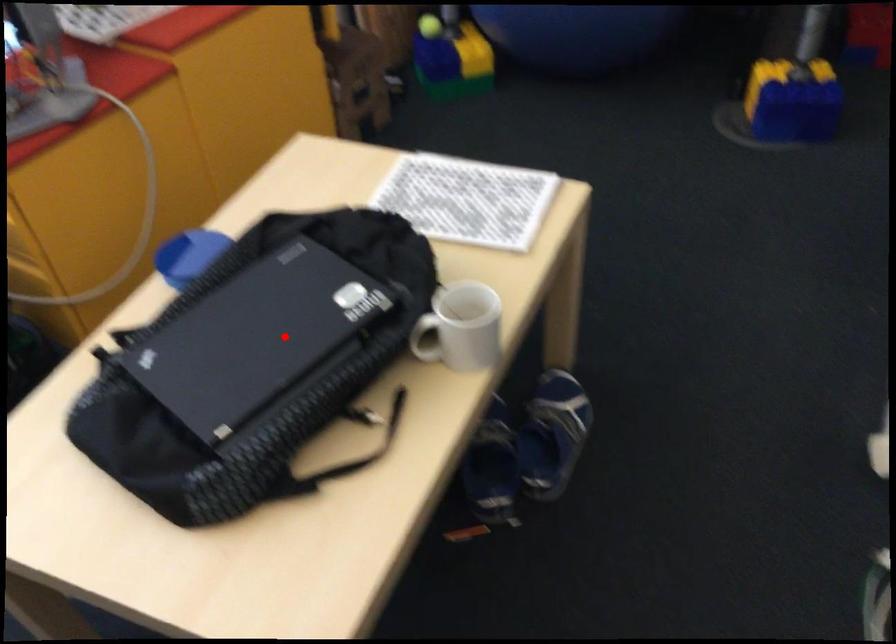
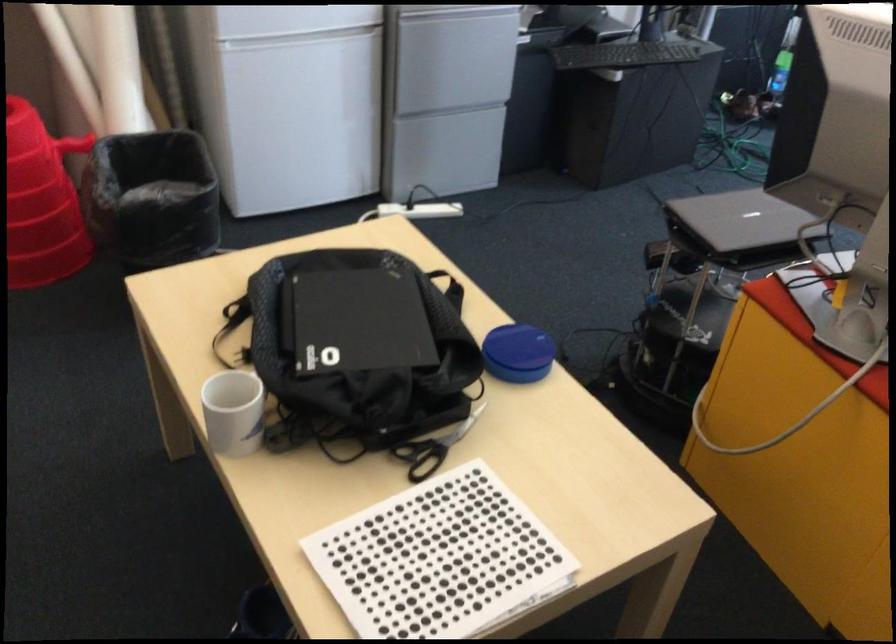
Question: I am providing you with two images of the same scene from different viewpoints. A red point is marked on the first image. At the location where the point appears in image 1, is it still visible in image 2?

Choices:
 (A) Yes
 (B) No

Answer: (A)